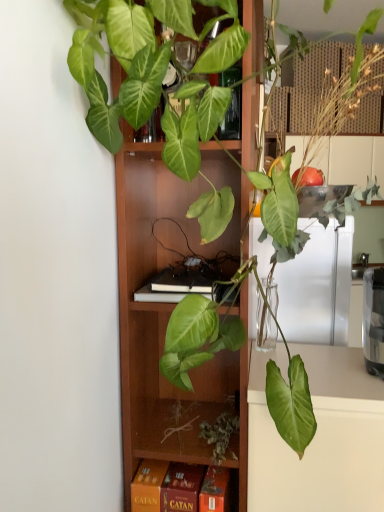
Question: Can you see orange matte board game at lower center touching wooden cabinet at center?

Choices:
 (A) no
 (B) yes

Answer: (A)

Question: Does orange matte board game at lower center appear on the left side of wooden cabinet at center?

Choices:
 (A) no
 (B) yes

Answer: (B)

Question: Can you confirm if orange matte board game at lower center is shorter than wooden cabinet at center?

Choices:
 (A) yes
 (B) no

Answer: (A)

Question: From the image's perspective, is orange matte board game at lower center over wooden cabinet at center?

Choices:
 (A) no
 (B) yes

Answer: (A)

Question: From a real-world perspective, is orange matte board game at lower center positioned under wooden cabinet at center based on gravity?

Choices:
 (A) yes
 (B) no

Answer: (A)

Question: Does orange matte board game at lower center have a smaller size compared to wooden cabinet at center?

Choices:
 (A) yes
 (B) no

Answer: (A)

Question: Is wooden cabinet at center positioned beyond the bounds of orange matte board game at lower center?

Choices:
 (A) no
 (B) yes

Answer: (B)

Question: Is wooden cabinet at center next to orange matte board game at lower center and touching it?

Choices:
 (A) no
 (B) yes

Answer: (A)

Question: Is wooden cabinet at center surrounding orange matte board game at lower center?

Choices:
 (A) yes
 (B) no

Answer: (A)

Question: Can you confirm if wooden cabinet at center is positioned to the left of orange matte board game at lower center?

Choices:
 (A) no
 (B) yes

Answer: (A)

Question: Does wooden cabinet at center have a smaller size compared to orange matte board game at lower center?

Choices:
 (A) yes
 (B) no

Answer: (B)

Question: Could you tell me if wooden cabinet at center is turned towards orange matte board game at lower center?

Choices:
 (A) yes
 (B) no

Answer: (A)

Question: Considering the positions of orange matte board game at lower center and wooden cabinet at center in the image, is orange matte board game at lower center wider or thinner than wooden cabinet at center?

Choices:
 (A) wide
 (B) thin

Answer: (B)